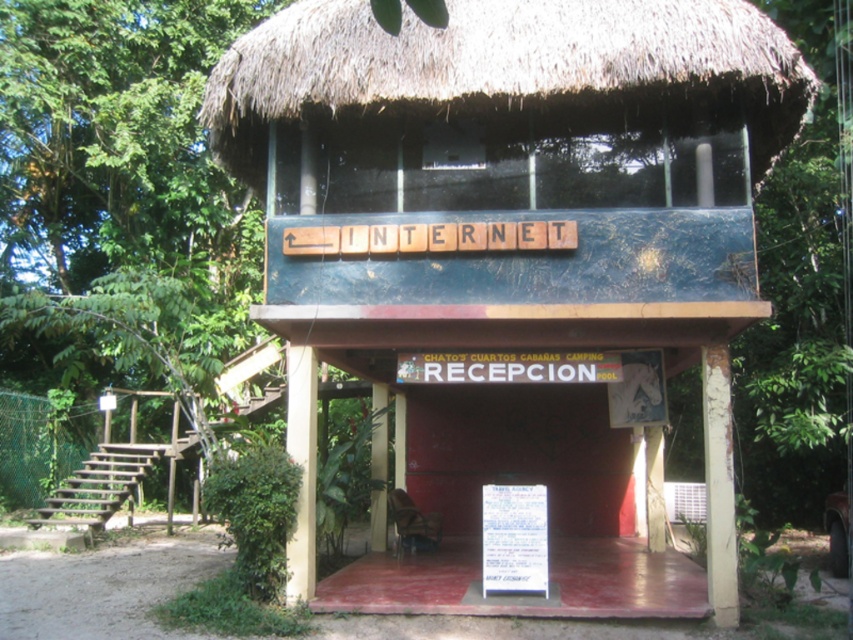
From the picture: You are a guest arriving at the rustic reception area. You see the blue painted wood hut at center and the white paper sign at center. Which object is shorter in height?

The blue painted wood hut at center is shorter in height compared to the white paper sign at center.

You are planning to hang a new sign that is 1 meter wide on the front of the blue painted wood hut at center. The current white paper sign at center is already mounted there. Considering the width of the existing sign, will there be enough space to place the new sign next to it without overlapping?

The blue painted wood hut at center is thinner than the white paper sign at center. Since the existing white paper sign at center is wider than the hut itself, there might not be sufficient space to add another 1 meter wide sign next to it without overlapping.